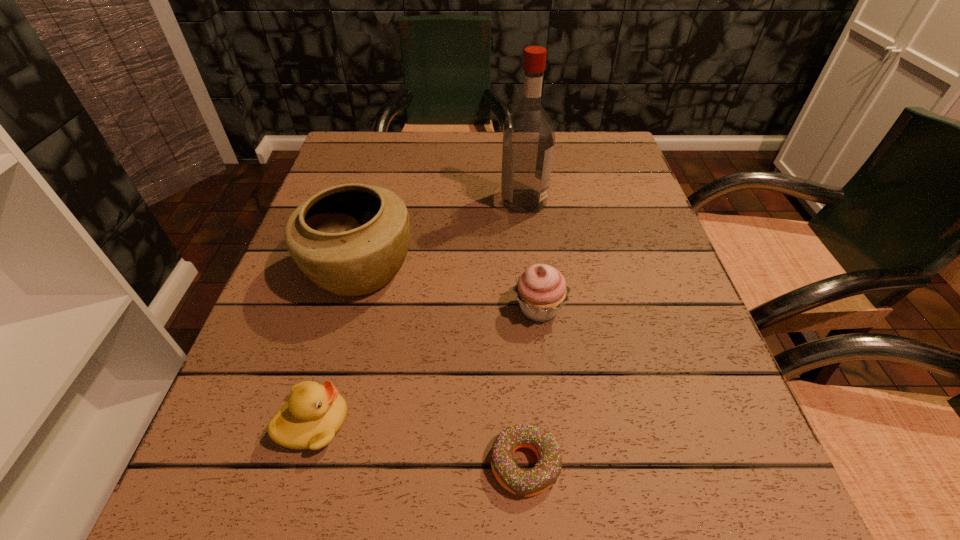
Locate an element on the screen. This screenshot has width=960, height=540. vacant space positioned 0.240m on the back of the cupcake is located at coordinates (x=527, y=211).

Find the location of `vacant area situated on the beak of the second shortest object`. vacant area situated on the beak of the second shortest object is located at coordinates (604, 423).

In order to click on free space located on the right of the shortest object in this screenshot , I will do `click(617, 464)`.

Locate an element on the screen. The image size is (960, 540). object that is positioned at the near edge is located at coordinates (522, 482).

Locate an element on the screen. The height and width of the screenshot is (540, 960). pottery that is at the left edge is located at coordinates coord(352,239).

The height and width of the screenshot is (540, 960). I want to click on duckling that is at the left edge, so click(x=314, y=413).

Locate an element on the screen. The image size is (960, 540). vacant space at the far edge of the desktop is located at coordinates (468, 135).

At what (x,y) coordinates should I click in order to perform the action: click on free space at the near edge. Please return your answer as a coordinate pair (x, y). This screenshot has height=540, width=960. Looking at the image, I should click on (427, 539).

In the image, there is a desktop. At what (x,y) coordinates should I click in order to perform the action: click on vacant space at the left edge. Please return your answer as a coordinate pair (x, y). Looking at the image, I should click on (252, 426).

In the image, there is a desktop. Identify the location of vacant space at the right edge. This screenshot has width=960, height=540. (619, 253).